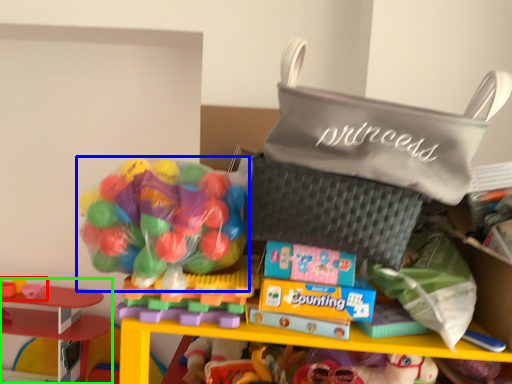
Question: Based on their relative distances, which object is nearer to toy (highlighted by a red box)? Choose from candy (highlighted by a blue box) and toy (highlighted by a green box).

Choices:
 (A) candy
 (B) toy

Answer: (B)